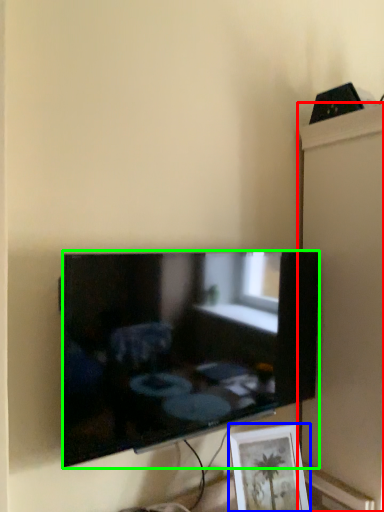
Question: Which object is the farthest from cabinet (highlighted by a red box)? Choose among these: picture frame (highlighted by a blue box) or television (highlighted by a green box).

Choices:
 (A) picture frame
 (B) television

Answer: (A)